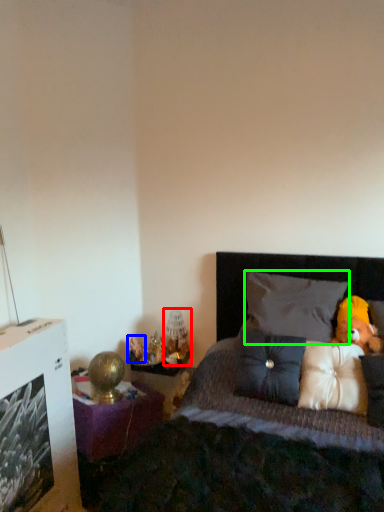
Question: Estimate the real-world distances between objects in this image. Which object is farther from table lamp (highlighted by a red box), toy (highlighted by a blue box) or pillow (highlighted by a green box)?

Choices:
 (A) toy
 (B) pillow

Answer: (B)